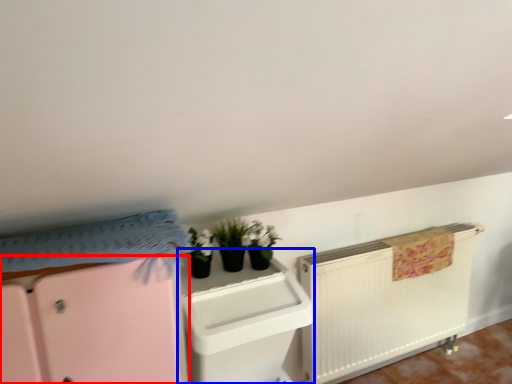
Question: Which point is closer to the camera, file cabinet (highlighted by a red box) or file cabinet (highlighted by a blue box)?

Choices:
 (A) file cabinet
 (B) file cabinet

Answer: (A)